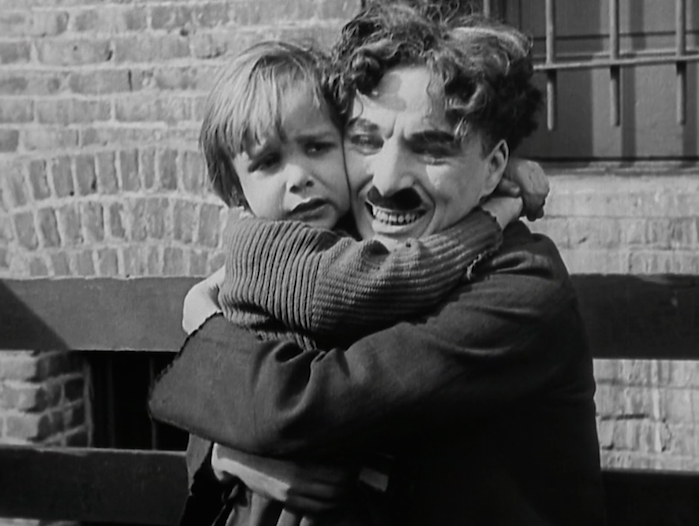
Find the location of a particular element. The height and width of the screenshot is (526, 699). wall is located at coordinates (122, 211).